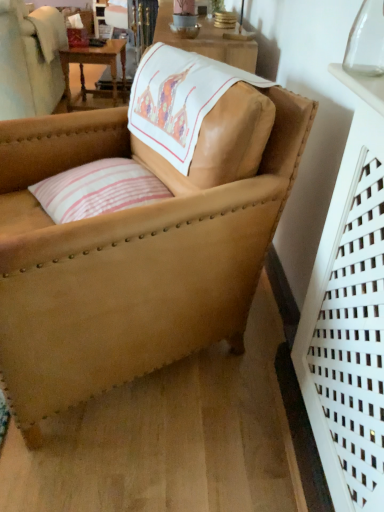
The width and height of the screenshot is (384, 512). What do you see at coordinates (98, 189) in the screenshot? I see `pink striped fabric pillow at center` at bounding box center [98, 189].

Locate an element on the screen. The width and height of the screenshot is (384, 512). wooden table at upper left is located at coordinates (98, 64).

Find the location of `transparent glass vase at upper right`. transparent glass vase at upper right is located at coordinates (366, 40).

The width and height of the screenshot is (384, 512). In order to click on pink striped fabric pillow at center in this screenshot , I will do `click(98, 189)`.

From a real-world perspective, which object stands above the other?

transparent glass vase at upper right.

At what (x,y) coordinates should I click in order to perform the action: click on table located behind the transparent glass vase at upper right. Please return your answer as a coordinate pair (x, y). The image size is (384, 512). Looking at the image, I should click on (98, 64).

Does transparent glass vase at upper right lie in front of wooden table at upper left?

Yes, it is.

Considering the sizes of objects wooden table at upper left and pink striped fabric pillow at center in the image provided, who is smaller, wooden table at upper left or pink striped fabric pillow at center?

pink striped fabric pillow at center is smaller.

Is wooden table at upper left behind pink striped fabric pillow at center?

Yes, it is behind pink striped fabric pillow at center.

Considering the positions of point (73, 105) and point (146, 184), is point (73, 105) closer or farther from the camera than point (146, 184)?

Point (73, 105) appears to be farther away from the viewer than point (146, 184).

Can you tell me how much wooden table at upper left and pink striped fabric pillow at center differ in facing direction?

There is a 29.8-degree angle between the facing directions of wooden table at upper left and pink striped fabric pillow at center.

Is wooden table at upper left behind transparent glass vase at upper right?

Yes, wooden table at upper left is behind transparent glass vase at upper right.

From the image's perspective, is wooden table at upper left located above transparent glass vase at upper right?

Yes, from the image's perspective, wooden table at upper left is on top of transparent glass vase at upper right.

Is wooden table at upper left situated inside transparent glass vase at upper right or outside?

wooden table at upper left lies outside transparent glass vase at upper right.

Is wooden table at upper left smaller than transparent glass vase at upper right?

No.

Is transparent glass vase at upper right to the left of leather armchair at center from the viewer's perspective?

No, transparent glass vase at upper right is not to the left of leather armchair at center.

Is transparent glass vase at upper right aimed at leather armchair at center?

No, transparent glass vase at upper right is not turned towards leather armchair at center.

Can you confirm if transparent glass vase at upper right is taller than leather armchair at center?

In fact, transparent glass vase at upper right may be shorter than leather armchair at center.

Is transparent glass vase at upper right bigger or smaller than leather armchair at center?

Considering their sizes, transparent glass vase at upper right takes up less space than leather armchair at center.

Which object is further away from the camera, pink striped fabric pillow at center or wooden table at upper left?

wooden table at upper left is more distant.

Which is more to the left, pink striped fabric pillow at center or wooden table at upper left?

Positioned to the left is wooden table at upper left.

From the image's perspective, is pink striped fabric pillow at center on top of wooden table at upper left?

No, from the image's perspective, pink striped fabric pillow at center is not over wooden table at upper left.

Is pink striped fabric pillow at center positioned with its back to wooden table at upper left?

No, pink striped fabric pillow at center is not facing the opposite direction of wooden table at upper left.

Can you tell me how much leather armchair at center and wooden table at upper left differ in facing direction?

The angle between the facing direction of leather armchair at center and the facing direction of wooden table at upper left is 29.8 degrees.

I want to click on table lying above the leather armchair at center (from the image's perspective), so click(98, 64).

Is wooden table at upper left at the back of leather armchair at center?

No, leather armchair at center is not facing away from wooden table at upper left.

From the image's perspective, is leather armchair at center over wooden table at upper left?

No, from the image's perspective, leather armchair at center is not over wooden table at upper left.

Considering the relative sizes of wooden table at upper left and leather armchair at center in the image provided, is wooden table at upper left taller than leather armchair at center?

In fact, wooden table at upper left may be shorter than leather armchair at center.

Can you see wooden table at upper left touching leather armchair at center?

No, wooden table at upper left is not making contact with leather armchair at center.

Does wooden table at upper left have a greater width compared to leather armchair at center?

In fact, wooden table at upper left might be narrower than leather armchair at center.

Considering the positions of point (77, 55) and point (206, 200), is point (77, 55) closer or farther from the camera than point (206, 200)?

Clearly, point (77, 55) is more distant from the camera than point (206, 200).

Locate an element on the screen. glass vase above the wooden table at upper left (from a real-world perspective) is located at coordinates (366, 40).

Locate an element on the screen. pillow in front of the wooden table at upper left is located at coordinates (98, 189).

From the image, which object appears to be farther from transparent glass vase at upper right, wooden table at upper left or leather armchair at center?

wooden table at upper left lies further to transparent glass vase at upper right than the other object.

Looking at the image, which one is located closer to pink striped fabric pillow at center, wooden table at upper left or leather armchair at center?

leather armchair at center lies closer to pink striped fabric pillow at center than the other object.

Which object lies further to the anchor point wooden table at upper left, pink striped fabric pillow at center or leather armchair at center?

The object further to wooden table at upper left is leather armchair at center.

Considering their positions, is pink striped fabric pillow at center positioned closer to transparent glass vase at upper right than leather armchair at center?

leather armchair at center is closer to transparent glass vase at upper right.

Estimate the real-world distances between objects in this image. Which object is further from pink striped fabric pillow at center, transparent glass vase at upper right or leather armchair at center?

transparent glass vase at upper right.

Estimate the real-world distances between objects in this image. Which object is further from leather armchair at center, wooden table at upper left or pink striped fabric pillow at center?

wooden table at upper left lies further to leather armchair at center than the other object.

Considering their positions, is leather armchair at center positioned further to pink striped fabric pillow at center than wooden table at upper left?

wooden table at upper left is positioned further to the anchor pink striped fabric pillow at center.

Considering their positions, is transparent glass vase at upper right positioned further to leather armchair at center than wooden table at upper left?

wooden table at upper left is further to leather armchair at center.

The image size is (384, 512). Identify the location of pillow between transparent glass vase at upper right and wooden table at upper left in the front-back direction. (98, 189).

In order to click on pillow between leather armchair at center and wooden table at upper left from front to back in this screenshot , I will do `click(98, 189)`.

The height and width of the screenshot is (512, 384). Identify the location of chair between pink striped fabric pillow at center and transparent glass vase at upper right in the horizontal direction. (127, 260).

The height and width of the screenshot is (512, 384). I want to click on chair located between transparent glass vase at upper right and wooden table at upper left in the depth direction, so click(x=127, y=260).